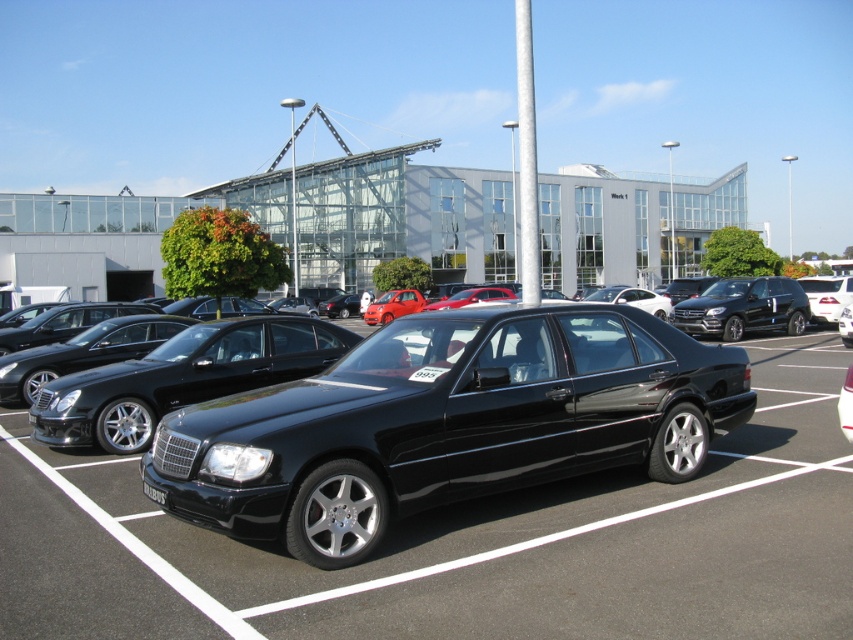
Does black metallic sedan at right appear under black plastic license plate at center?

Actually, black metallic sedan at right is above black plastic license plate at center.

Between point (782, 323) and point (160, 492), which one is positioned behind?

The point (782, 323) is behind.

Is point (724, 316) positioned before point (160, 499)?

No, it is not.

At what (x,y) coordinates should I click in order to perform the action: click on black metallic sedan at right. Please return your answer as a coordinate pair (x, y). This screenshot has height=640, width=853. Looking at the image, I should click on (743, 307).

Is point (393, 582) positioned after point (799, 317)?

No, (393, 582) is in front of (799, 317).

Between point (67, 483) and point (764, 300), which one is positioned in front?

Point (67, 483) is more forward.

The image size is (853, 640). Identify the location of glossy black car at center. (469, 545).

Is glossy black car at center above black plastic license plate at center?

No.

Is glossy black car at center smaller than black plastic license plate at center?

Actually, glossy black car at center might be larger than black plastic license plate at center.

Measure the distance between glossy black car at center and camera.

3.82 meters

Identify the location of glossy black car at center. The height and width of the screenshot is (640, 853). (469, 545).